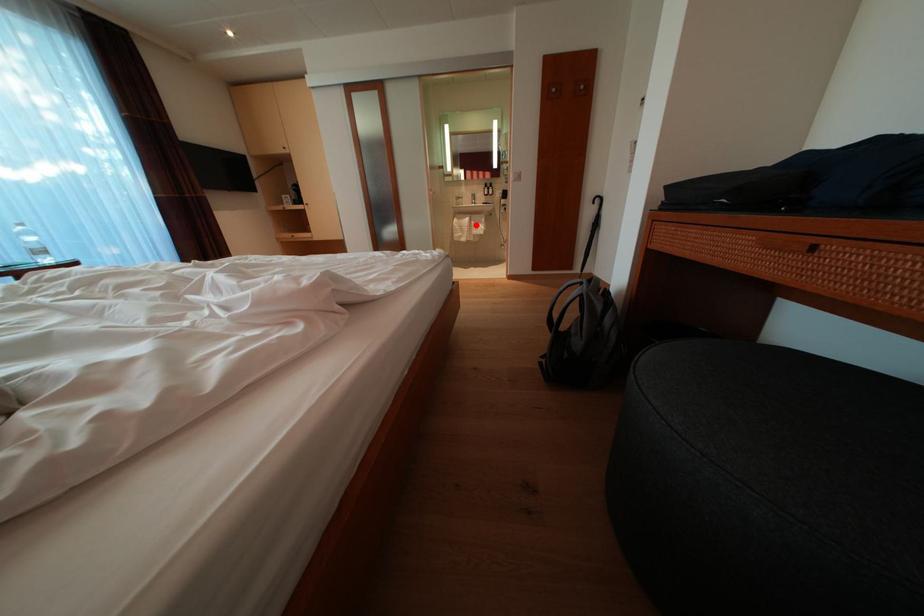
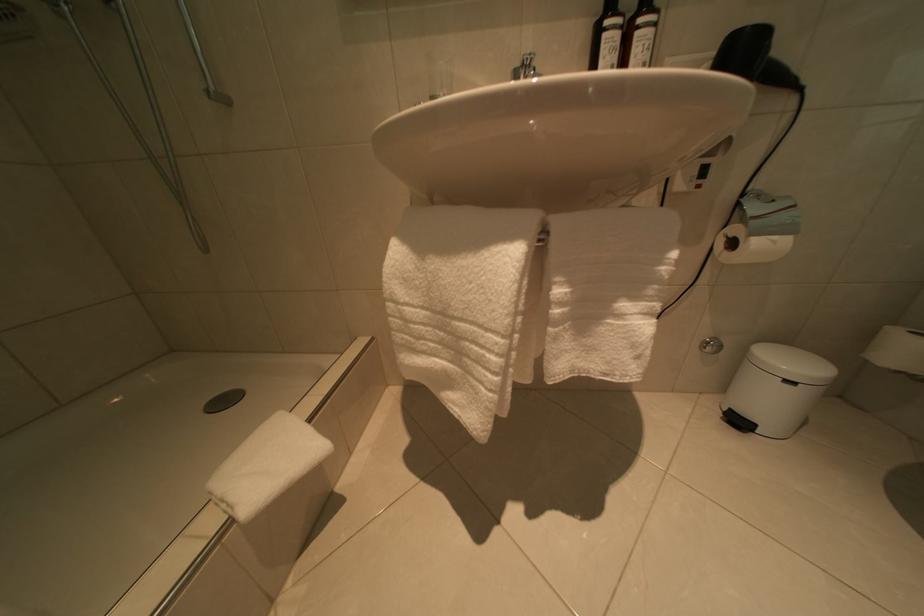
Question: I am providing you with two images of the same scene from different viewpoints. Given a red point in image1, look at the same physical point in image2. Is it:

Choices:
 (A) Closer to the viewpoint
 (B) Farther from the viewpoint

Answer: (B)